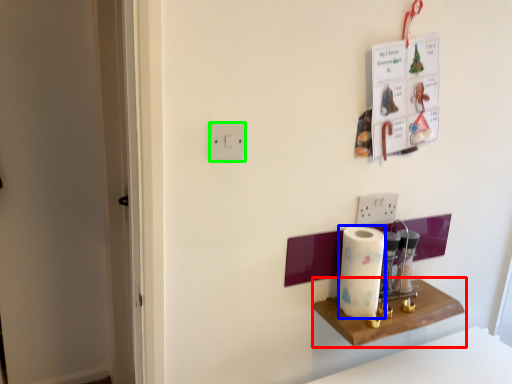
Question: Based on their relative distances, which object is farther from shelf (highlighted by a red box)? Choose from paper towel (highlighted by a blue box) and light switch (highlighted by a green box).

Choices:
 (A) paper towel
 (B) light switch

Answer: (B)